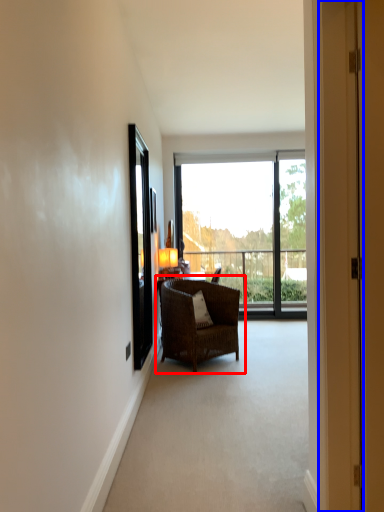
Question: Which of the following is the farthest to the observer, chair (highlighted by a red box) or door (highlighted by a blue box)?

Choices:
 (A) chair
 (B) door

Answer: (A)